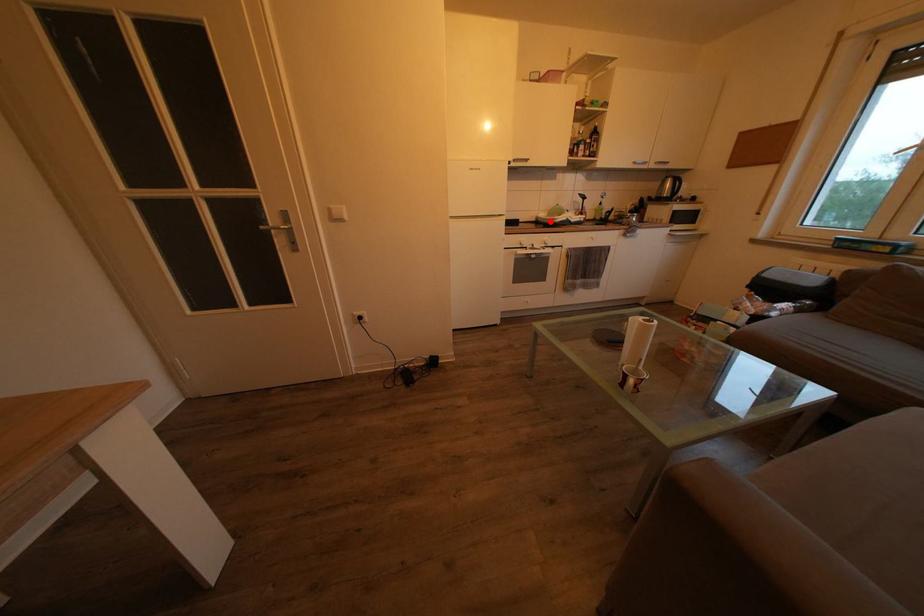
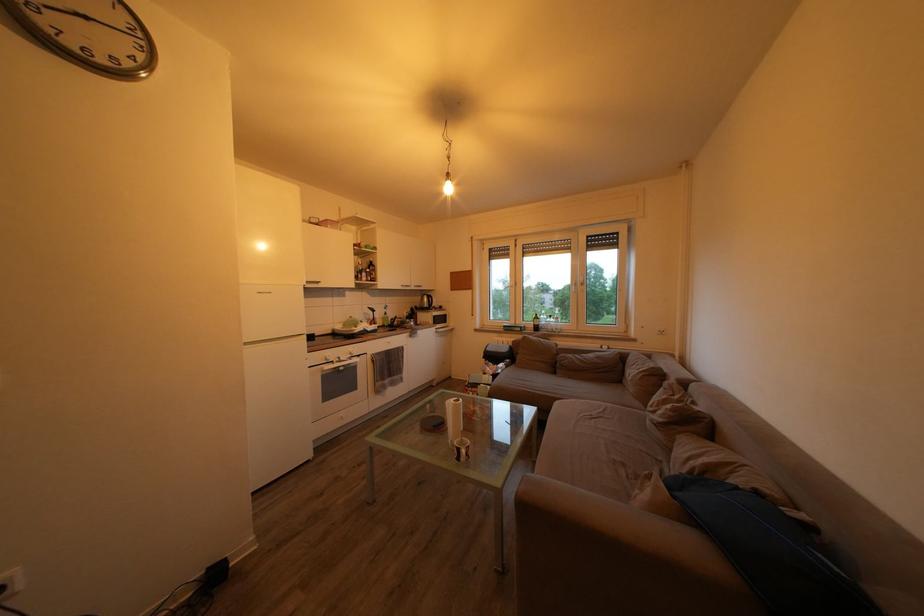
Question: I am providing you with two images of the same scene from different viewpoints. Given a red point in image1, look at the same physical point in image2. Is it:

Choices:
 (A) Closer to the viewpoint
 (B) Farther from the viewpoint

Answer: (B)